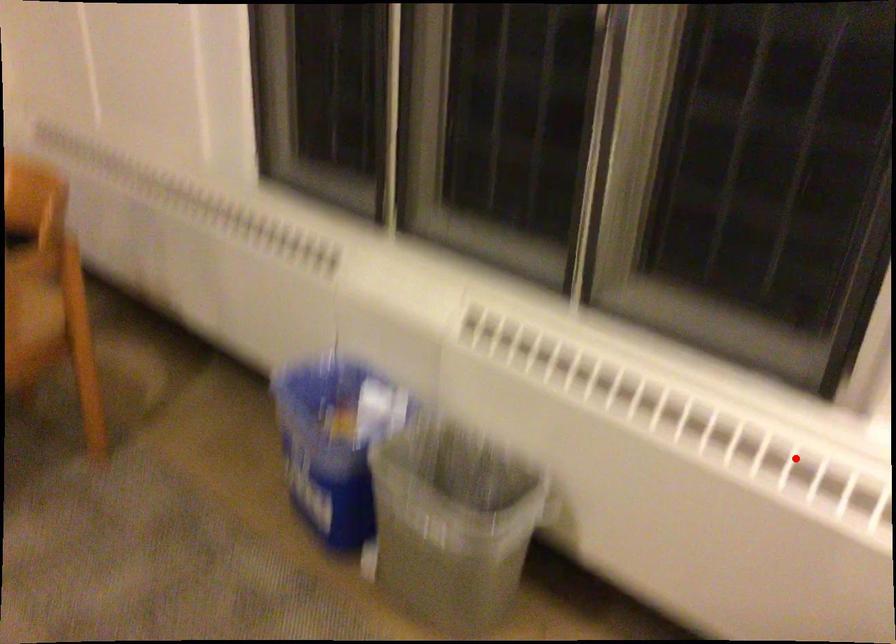
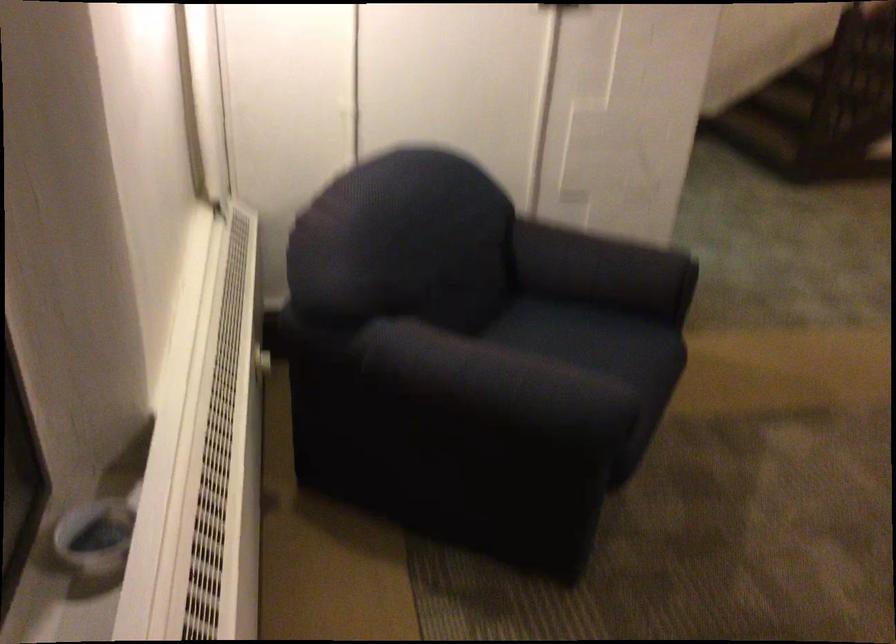
Locate, in the second image, the point that corresponds to the highlighted location in the first image.

(218, 462)